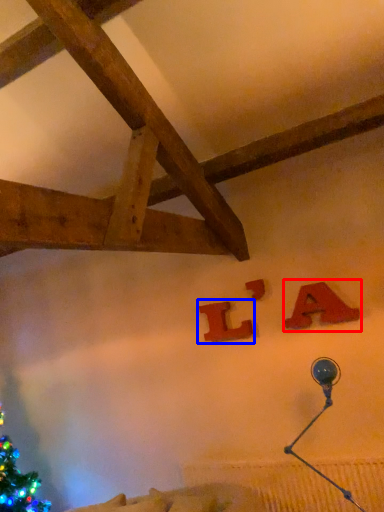
Question: Which object appears farthest to the camera in this image, alphabet (highlighted by a red box) or alphabet (highlighted by a blue box)?

Choices:
 (A) alphabet
 (B) alphabet

Answer: (B)